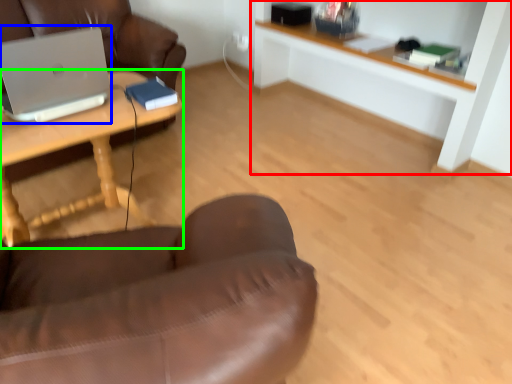
Question: Which is farther away from shelf (highlighted by a red box)? laptop (highlighted by a blue box) or desk (highlighted by a green box)?

Choices:
 (A) laptop
 (B) desk

Answer: (A)